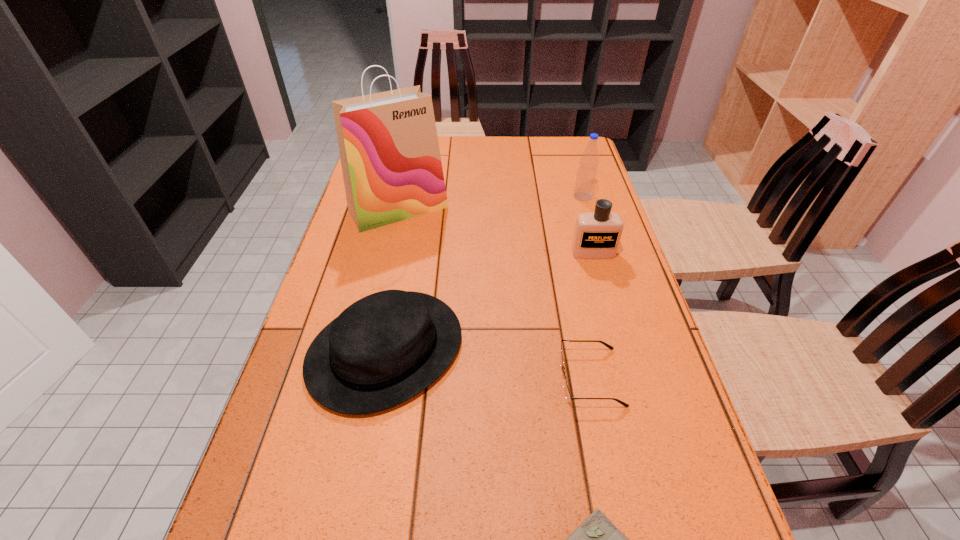
Where is `the tallest object`? The image size is (960, 540). the tallest object is located at coordinates (388, 144).

Locate an element on the screen. The image size is (960, 540). the fifth shortest object is located at coordinates (586, 177).

In order to click on perfume in this screenshot , I will do `click(597, 234)`.

The height and width of the screenshot is (540, 960). What are the coordinates of `the fourth shortest object` in the screenshot? It's located at (597, 234).

What are the coordinates of `fedora` in the screenshot? It's located at (384, 349).

This screenshot has height=540, width=960. I want to click on spectacles, so click(x=568, y=396).

Image resolution: width=960 pixels, height=540 pixels. I want to click on free space located 0.050m on the right of the tallest object, so click(465, 209).

Identify the location of free space located 0.240m on the front of the water bottle. Image resolution: width=960 pixels, height=540 pixels. (599, 251).

The width and height of the screenshot is (960, 540). I want to click on free region located 0.270m on the front label of the perfume, so click(617, 339).

Locate an element on the screen. The height and width of the screenshot is (540, 960). vacant position located on the right of the fedora is located at coordinates (623, 349).